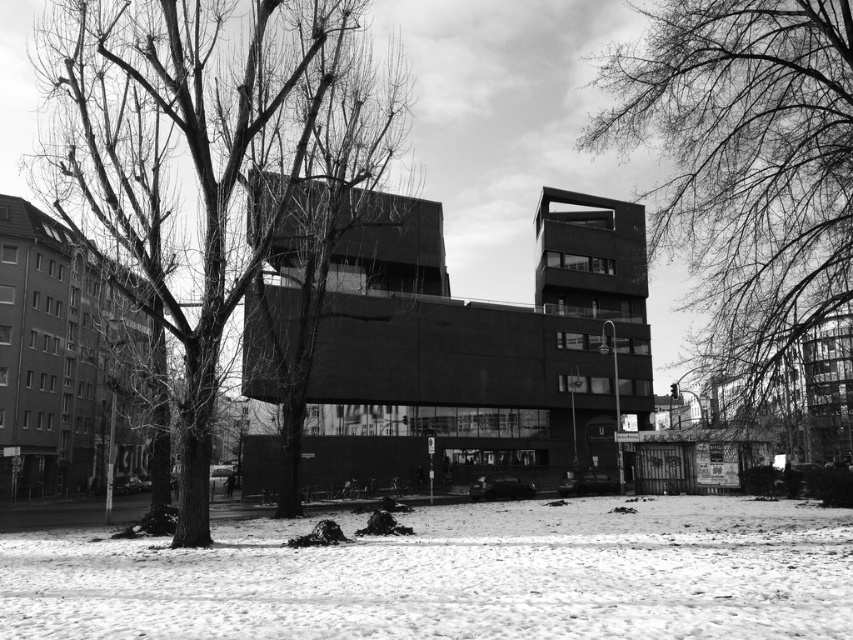
You are standing in front of the modern building in the image. There are two points marked on the snow near the trees. The first point is at coordinates point (721, 534) and the second point is at point (281, 461). Which point is closer to you?

Point (721, 534) is closer to the camera than point (281, 461).